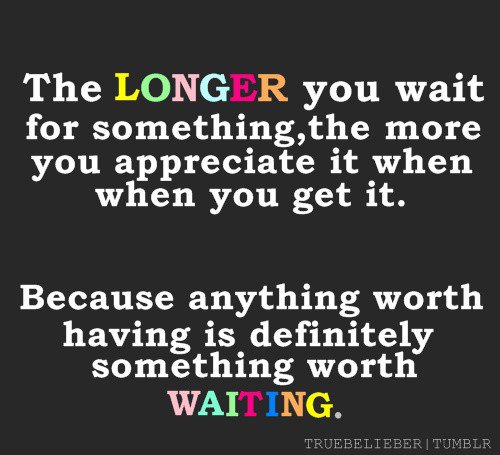
Where is `divider`? divider is located at coordinates (428, 445).